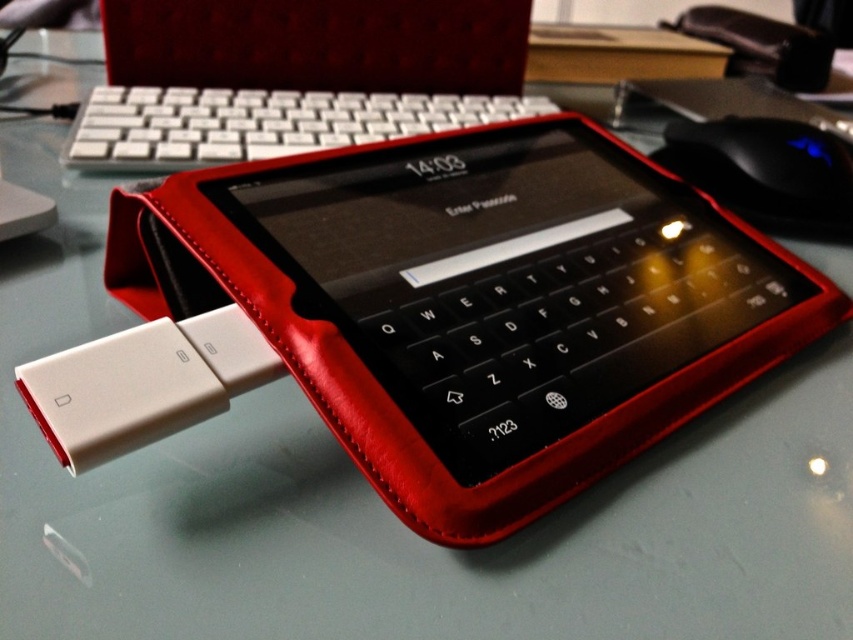
You are organizing a desk and need to place the white plastic keyboard at upper center and the black plastic mouse at upper right. If the desk space is limited, which item should you prioritize placing first to ensure both fit?

The white plastic keyboard at upper center should be placed first since it is bigger than the black plastic mouse at upper right, ensuring there is enough space for both items.

You are trying to determine the relative positions of two points in the workspace image. Given that you are looking at the scene from a standard viewing angle, which of the two points, point (80, 108) or point (737, 148), is closer to you?

Point (80, 108) is closer to the viewer than point (737, 148) because it is further to the viewer according to the description.

You are holding a 1.5 meter long pole and want to place it on the desk without it touching any objects. The desk has a point at coordinates point (100,97). Can you place the pole so that it extends from the edge of the desk to this point without overlapping any objects?

The point (100,97) is 1.42 meters from the camera. Since the pole is 1.5 meters long, it would extend beyond the point and might touch other objects on the desk. Therefore, it might not be possible to place the pole without overlapping objects.